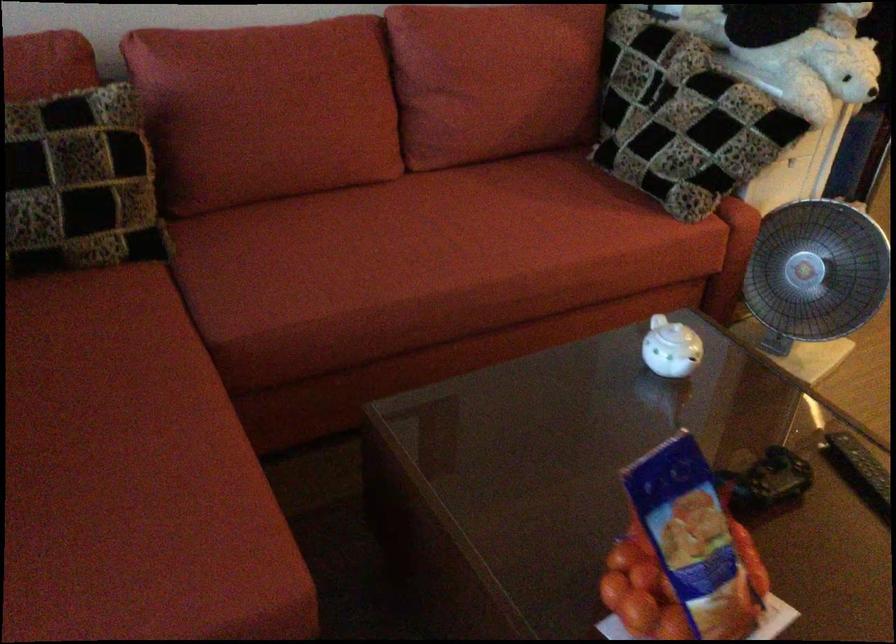
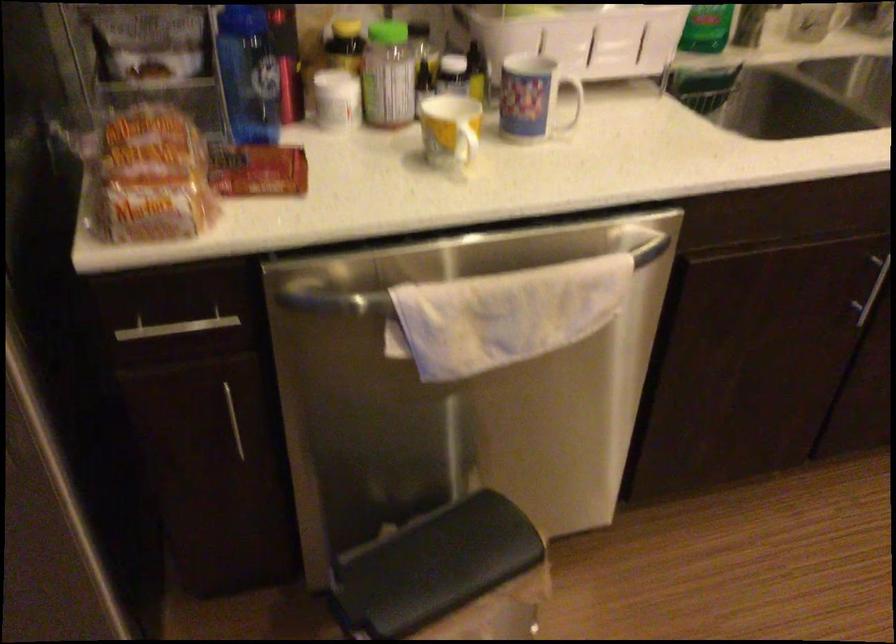
In a continuous first-person perspective shot, in which direction is the camera moving?

The movement direction of the cameraman is right, forward.